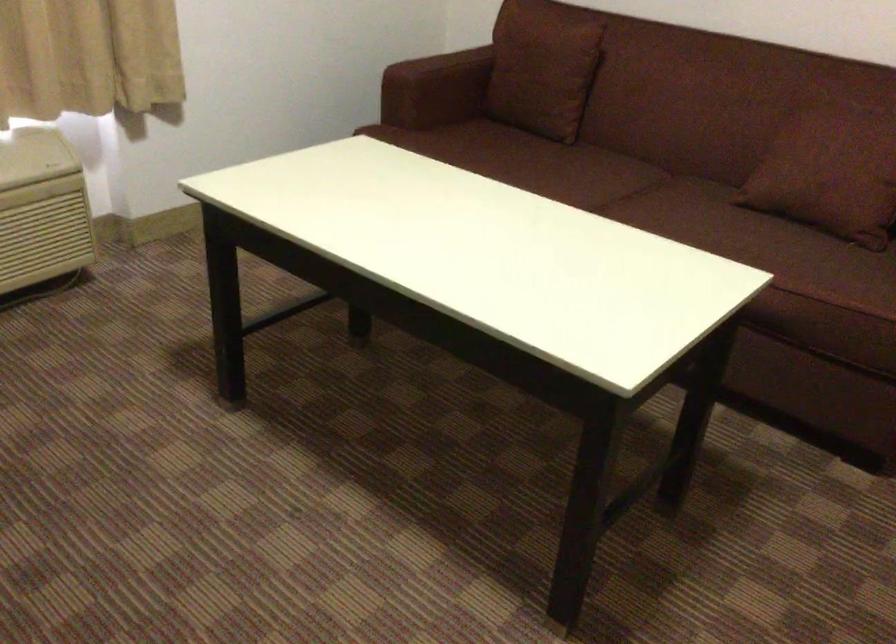
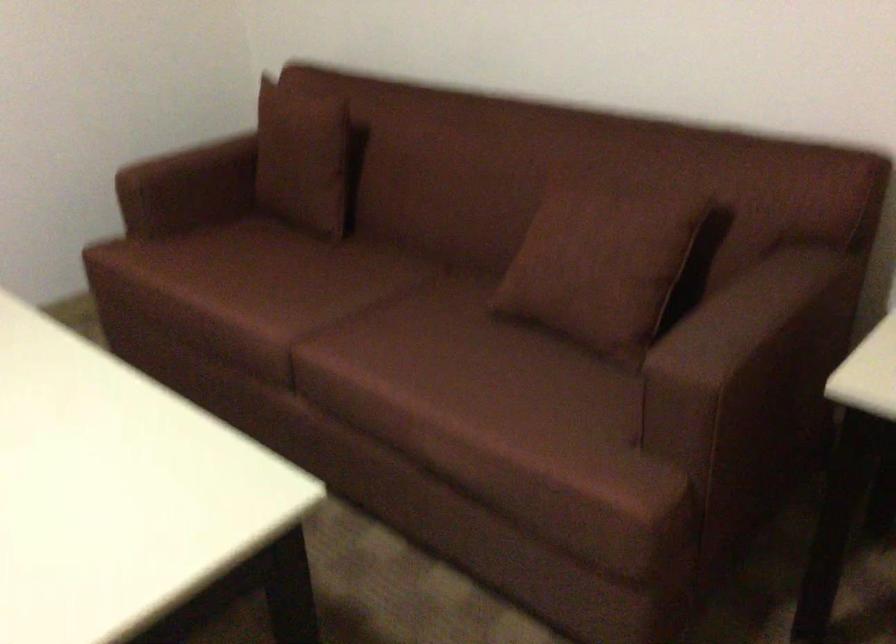
Question: Based on the continuous images, in which direction is the camera rotating? Reply with the corresponding letter.

Choices:
 (A) Left
 (B) Right
 (C) Up
 (D) Down

Answer: (A)